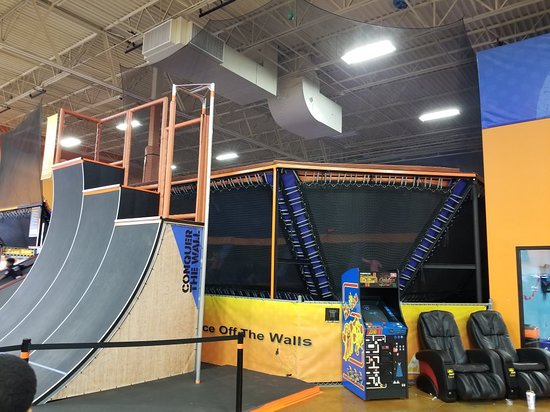
Identify the location of arm rest on chair. The width and height of the screenshot is (550, 412). (440, 353).